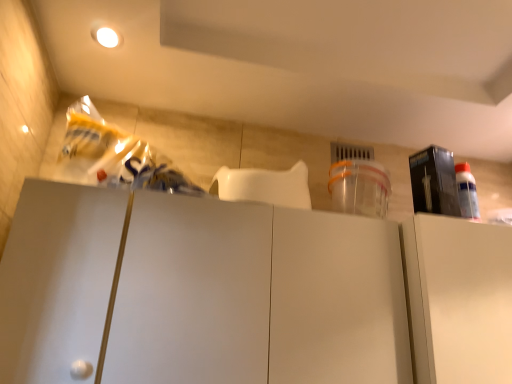
Measure the distance between point (426, 163) and camera.

A distance of 1.28 meters exists between point (426, 163) and camera.

Identify the location of white matte cabinet at center, the 2th cabinetry positioned from the right. This screenshot has width=512, height=384. (246, 292).

What do you see at coordinates (458, 299) in the screenshot?
I see `white matte cabinet at right, which ranks as the 1th cabinetry in right-to-left order` at bounding box center [458, 299].

The image size is (512, 384). Find the location of `matte black box at upper right`. matte black box at upper right is located at coordinates (434, 182).

Consider the image. From a real-world perspective, which is physically above, white matte cabinet at center, the 2th cabinetry positioned from the right, or matte black box at upper right?

matte black box at upper right, from a real-world perspective.

Considering the relative positions of white matte cabinet at center, which ranks as the 1th cabinetry in left-to-right order, and matte black box at upper right in the image provided, is white matte cabinet at center, which ranks as the 1th cabinetry in left-to-right order, to the left of matte black box at upper right from the viewer's perspective?

Correct, you'll find white matte cabinet at center, which ranks as the 1th cabinetry in left-to-right order, to the left of matte black box at upper right.

Does point (190, 350) come closer to viewer compared to point (453, 164)?

Yes, it is in front of point (453, 164).

Could you tell me if white matte cabinet at center, the 2th cabinetry positioned from the right, is turned towards matte black box at upper right?

No, white matte cabinet at center, the 2th cabinetry positioned from the right, is not aimed at matte black box at upper right.

Is white matte cabinet at right, which is the second cabinetry from left to right, aimed at white matte cabinet at center, the 2th cabinetry positioned from the right?

No, white matte cabinet at right, which is the second cabinetry from left to right, is not aimed at white matte cabinet at center, the 2th cabinetry positioned from the right.

Considering their positions, is white matte cabinet at right, which is the second cabinetry from left to right, located in front of or behind white matte cabinet at center, which ranks as the 1th cabinetry in left-to-right order?

white matte cabinet at right, which is the second cabinetry from left to right, is positioned farther from the viewer than white matte cabinet at center, which ranks as the 1th cabinetry in left-to-right order.

From the image's perspective, who appears lower, white matte cabinet at right, which is the second cabinetry from left to right, or white matte cabinet at center, the 2th cabinetry positioned from the right?

white matte cabinet at right, which is the second cabinetry from left to right, appears lower in the image.

From a real-world perspective, does white matte cabinet at center, the 2th cabinetry positioned from the right, sit lower than white matte cabinet at right, which is the second cabinetry from left to right?

Yes, from a real-world perspective, white matte cabinet at center, the 2th cabinetry positioned from the right, is beneath white matte cabinet at right, which is the second cabinetry from left to right.

Can you confirm if white matte cabinet at center, the 2th cabinetry positioned from the right, is wider than white matte cabinet at right, which ranks as the 1th cabinetry in right-to-left order?

No, white matte cabinet at center, the 2th cabinetry positioned from the right, is not wider than white matte cabinet at right, which ranks as the 1th cabinetry in right-to-left order.

Can you confirm if white matte cabinet at center, the 2th cabinetry positioned from the right, is shorter than white matte cabinet at right, which is the second cabinetry from left to right?

Incorrect, the height of white matte cabinet at center, the 2th cabinetry positioned from the right, does not fall short of that of white matte cabinet at right, which is the second cabinetry from left to right.

What's the angular difference between white matte cabinet at center, which ranks as the 1th cabinetry in left-to-right order, and white matte cabinet at right, which ranks as the 1th cabinetry in right-to-left order,'s facing directions?

0.000124 degrees.

Is point (431, 200) closer or farther from the camera than point (453, 283)?

Point (431, 200).

Looking at this image, does matte black box at upper right come behind white matte cabinet at center, which ranks as the 1th cabinetry in left-to-right order?

Yes, it is behind white matte cabinet at center, which ranks as the 1th cabinetry in left-to-right order.

Could you measure the distance between matte black box at upper right and white matte cabinet at center, the 2th cabinetry positioned from the right?

matte black box at upper right is 18.81 inches from white matte cabinet at center, the 2th cabinetry positioned from the right.

Based on the photo, how many degrees apart are the facing directions of matte black box at upper right and white matte cabinet at center, the 2th cabinetry positioned from the right?

There is a 8.88e-05-degree angle between the facing directions of matte black box at upper right and white matte cabinet at center, the 2th cabinetry positioned from the right.

Is white matte cabinet at right, which is the second cabinetry from left to right, at the back of matte black box at upper right?

No.

Considering the positions of objects matte black box at upper right and white matte cabinet at right, which ranks as the 1th cabinetry in right-to-left order, in the image provided, who is in front, matte black box at upper right or white matte cabinet at right, which ranks as the 1th cabinetry in right-to-left order,?

white matte cabinet at right, which ranks as the 1th cabinetry in right-to-left order, is in front.

Based on their positions, is matte black box at upper right located to the left or right of white matte cabinet at right, which is the second cabinetry from left to right?

From the image, it's evident that matte black box at upper right is to the left of white matte cabinet at right, which is the second cabinetry from left to right.

Considering the relative sizes of matte black box at upper right and white matte cabinet at right, which ranks as the 1th cabinetry in right-to-left order, in the image provided, is matte black box at upper right taller than white matte cabinet at right, which ranks as the 1th cabinetry in right-to-left order,?

In fact, matte black box at upper right may be shorter than white matte cabinet at right, which ranks as the 1th cabinetry in right-to-left order.

Looking at their sizes, would you say white matte cabinet at right, which ranks as the 1th cabinetry in right-to-left order, is wider or thinner than matte black box at upper right?

In the image, white matte cabinet at right, which ranks as the 1th cabinetry in right-to-left order, appears to be wider than matte black box at upper right.

From a real-world perspective, is white matte cabinet at right, which ranks as the 1th cabinetry in right-to-left order, beneath matte black box at upper right?

Yes.

How different are the orientations of white matte cabinet at right, which is the second cabinetry from left to right, and matte black box at upper right in degrees?

3.5e-05 degrees separate the facing orientations of white matte cabinet at right, which is the second cabinetry from left to right, and matte black box at upper right.

This screenshot has height=384, width=512. I want to click on the 2nd cabinetry positioned below the matte black box at upper right (from a real-world perspective), so click(x=246, y=292).

Where is `cabinetry above the white matte cabinet at right, which is the second cabinetry from left to right (from the image's perspective)`? This screenshot has width=512, height=384. cabinetry above the white matte cabinet at right, which is the second cabinetry from left to right (from the image's perspective) is located at coordinates (246, 292).

Looking at the image, which one is located further to white matte cabinet at right, which ranks as the 1th cabinetry in right-to-left order, white matte cabinet at center, which ranks as the 1th cabinetry in left-to-right order, or matte black box at upper right?

matte black box at upper right is positioned further to the anchor white matte cabinet at right, which ranks as the 1th cabinetry in right-to-left order.

Looking at the image, which one is located further to white matte cabinet at center, the 2th cabinetry positioned from the right, matte black box at upper right or white matte cabinet at right, which ranks as the 1th cabinetry in right-to-left order?

matte black box at upper right lies further to white matte cabinet at center, the 2th cabinetry positioned from the right, than the other object.

When comparing their distances from matte black box at upper right, does white matte cabinet at center, the 2th cabinetry positioned from the right, or white matte cabinet at right, which ranks as the 1th cabinetry in right-to-left order, seem closer?

white matte cabinet at right, which ranks as the 1th cabinetry in right-to-left order, is positioned closer to the anchor matte black box at upper right.

Considering their positions, is white matte cabinet at right, which ranks as the 1th cabinetry in right-to-left order, positioned closer to white matte cabinet at center, which ranks as the 1th cabinetry in left-to-right order, than matte black box at upper right?

Based on the image, white matte cabinet at right, which ranks as the 1th cabinetry in right-to-left order, appears to be nearer to white matte cabinet at center, which ranks as the 1th cabinetry in left-to-right order.

Estimate the real-world distances between objects in this image. Which object is further from white matte cabinet at right, which is the second cabinetry from left to right, matte black box at upper right or white matte cabinet at center, the 2th cabinetry positioned from the right?

matte black box at upper right lies further to white matte cabinet at right, which is the second cabinetry from left to right, than the other object.

Based on their spatial positions, is white matte cabinet at right, which ranks as the 1th cabinetry in right-to-left order, or white matte cabinet at center, the 2th cabinetry positioned from the right, further from matte black box at upper right?

white matte cabinet at center, the 2th cabinetry positioned from the right, lies further to matte black box at upper right than the other object.

I want to click on appliance situated between white matte cabinet at center, the 2th cabinetry positioned from the right, and white matte cabinet at right, which is the second cabinetry from left to right, from left to right, so click(x=434, y=182).